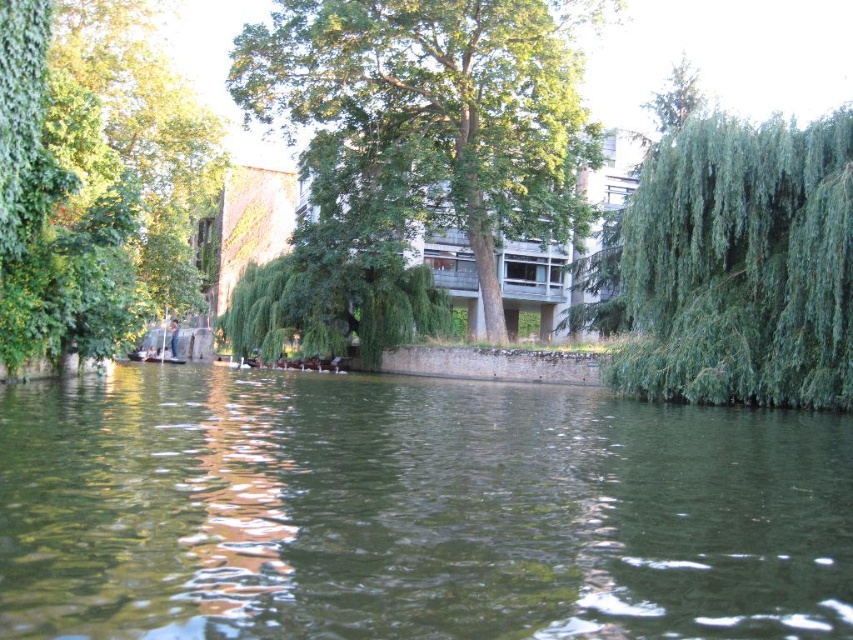
Looking at this image, you are standing on the boat and want to know which of the two green leafy willows is closer to you. The green leafy willow at right or the green leafy willow at center?

The green leafy willow at right is much taller than the green leafy willow at center, so the green leafy willow at center is closer to you.

You are standing on a boat in the middle of the river and want to navigate towards the stone embankment. According to the image, where is the greenish water at center located relative to your current position?

The greenish water at center is located at point 0.800 on the x axis and 0.484 on the y axis, so it is positioned to the right and slightly above your current position on the boat.